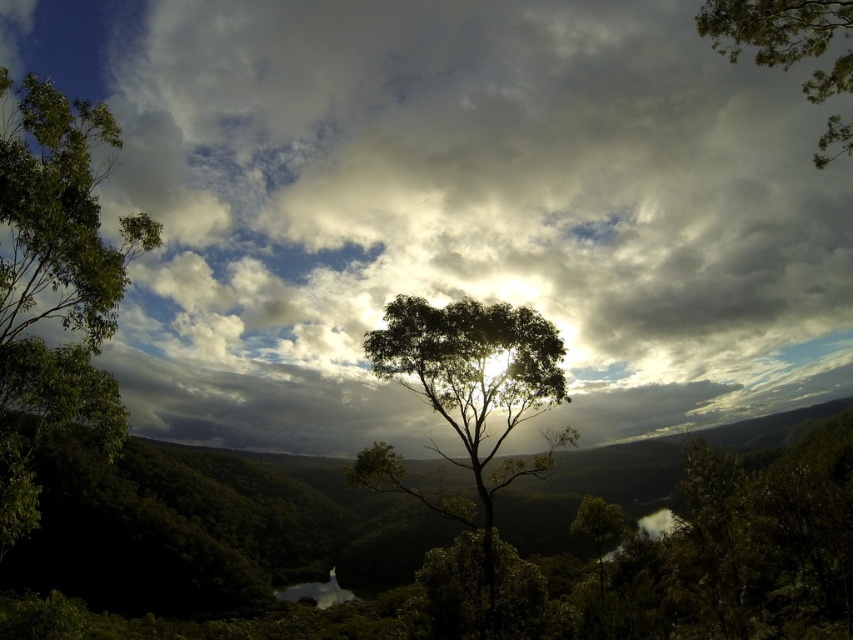
Is point (453, 502) behind point (796, 8)?

Yes, point (453, 502) is farther from viewer.

Is the position of green leafy tree at center more distant than that of green leafy tree at upper right?

Yes, green leafy tree at center is further from the viewer.

Between point (465, 401) and point (822, 48), which one is positioned in front?

Point (822, 48) is more forward.

I want to click on green leafy tree at center, so click(468, 400).

Is cloudy sky at upper center thinner than green leafy tree at center?

No.

The height and width of the screenshot is (640, 853). What do you see at coordinates (451, 209) in the screenshot?
I see `cloudy sky at upper center` at bounding box center [451, 209].

Does point (329, 42) come farther from viewer compared to point (503, 410)?

Yes, it is.

Identify the location of cloudy sky at upper center. Image resolution: width=853 pixels, height=640 pixels. (451, 209).

Can you confirm if green leafy tree at left is positioned to the right of green leafy tree at upper right?

Incorrect, green leafy tree at left is not on the right side of green leafy tree at upper right.

Between green leafy tree at left and green leafy tree at upper right, which one appears on the right side from the viewer's perspective?

green leafy tree at upper right is more to the right.

Between point (13, 132) and point (712, 26), which one is positioned behind?

The point (712, 26) is behind.

Where is `green leafy tree at left`? green leafy tree at left is located at coordinates (54, 284).